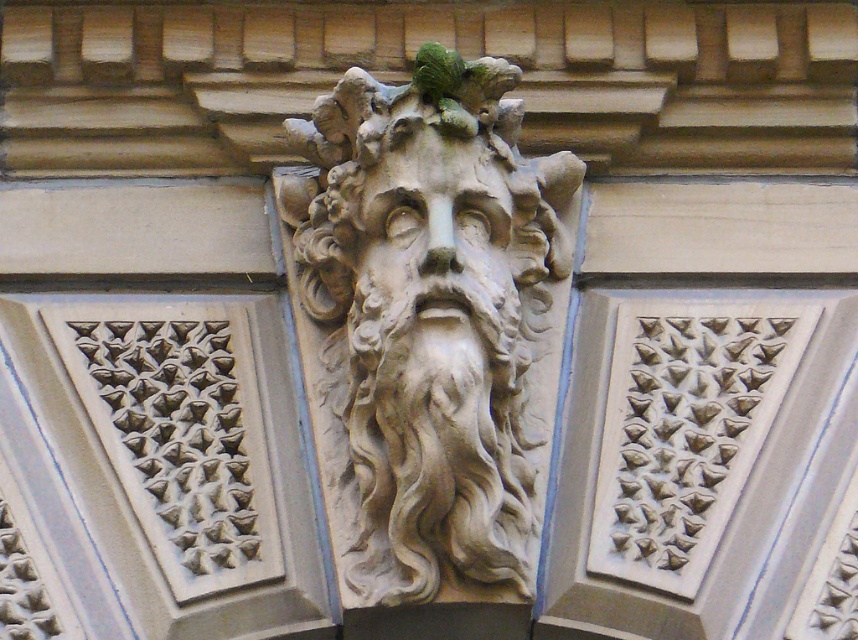
Who is more distant from viewer, (349, 572) or (478, 188)?

Point (478, 188)

Can you confirm if stone sculpture at center is shorter than stone textured face at center?

No, stone sculpture at center is not shorter than stone textured face at center.

The image size is (858, 640). What do you see at coordinates (427, 323) in the screenshot?
I see `stone sculpture at center` at bounding box center [427, 323].

Image resolution: width=858 pixels, height=640 pixels. I want to click on stone sculpture at center, so click(427, 323).